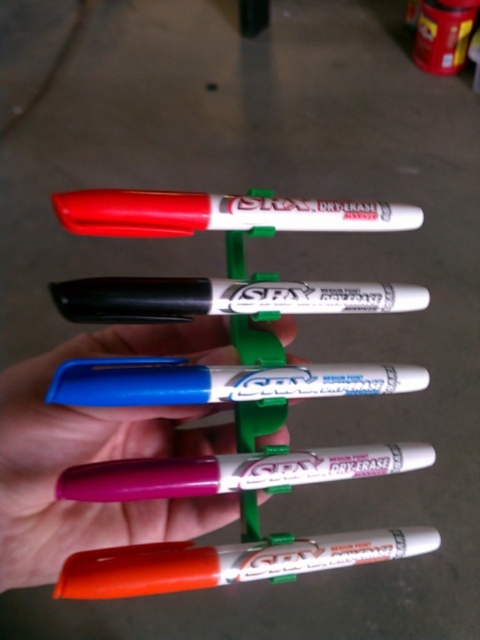
You are organizing a classroom and need to choose between the purple matte marker at center and the white glossy marker at center for a student project. Which marker is bigger in size?

The purple matte marker at center is larger in size compared to the white glossy marker at center.

You are a robot trying to pick up the markers. The robot has a camera that can see two points in the image labeled as point (x=127, y=573) and point (x=217, y=365). Which point should the robot move towards first to reach the closer one?

The robot should move towards point (x=127, y=573) first because it is closer to the viewer than point (x=217, y=365).

You are organizing a classroom supply closet and need to place the purple matte marker at center and the white glossy marker at center into a vertical rack. The rack has two slots side by side. Which marker should go in the lower slot to match their arrangement in the image?

The purple matte marker at center should go in the lower slot because it is located below the white glossy marker at center in the image.